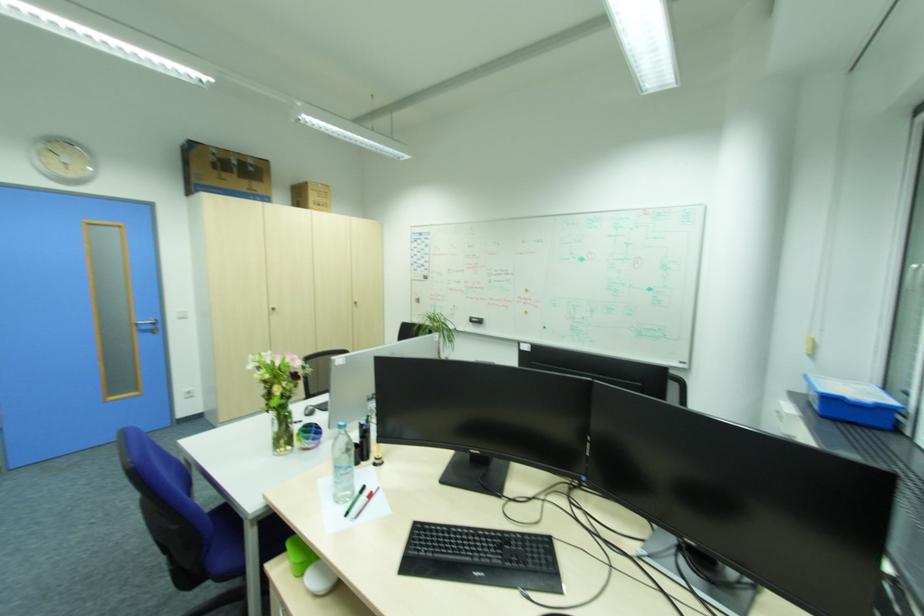
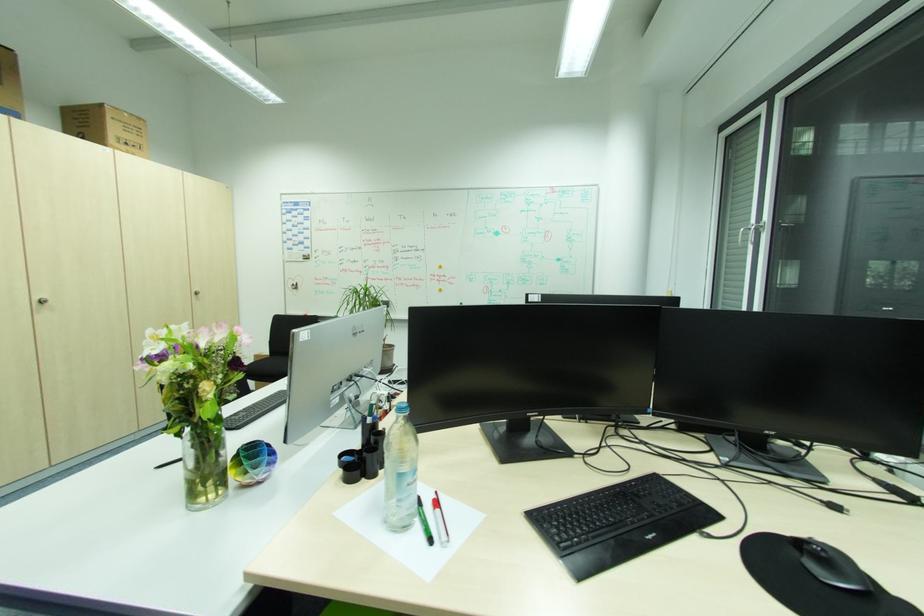
The point at (x=284, y=451) is marked in the first image. Where is the corresponding point in the second image?

(208, 500)